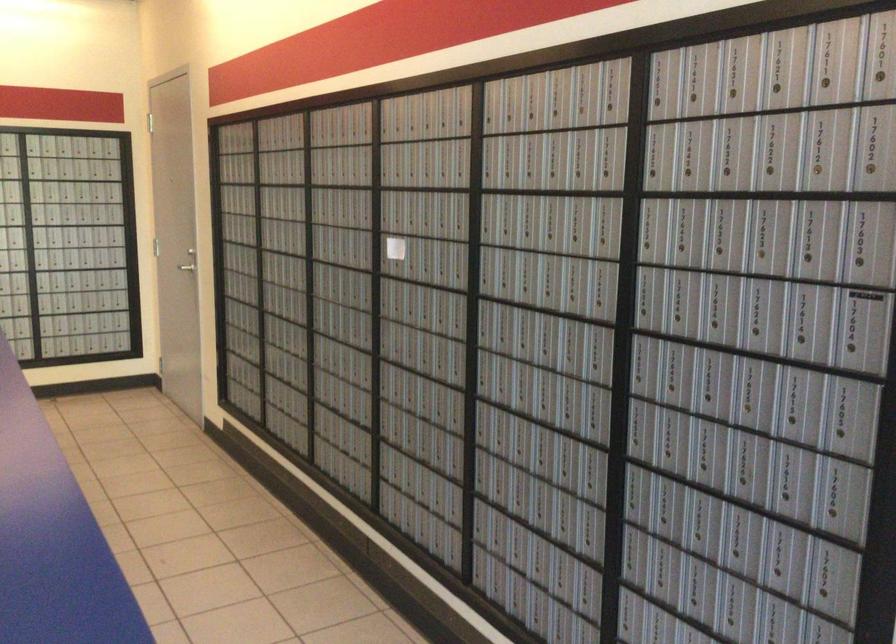
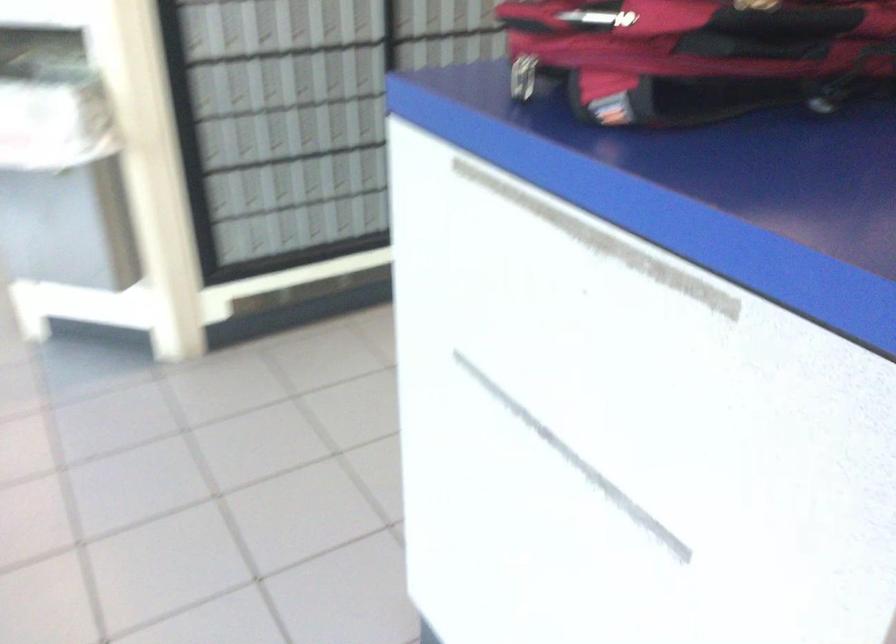
The images are taken continuously from a first-person perspective. In which direction is your viewpoint rotating?

The camera rotated toward left-down.